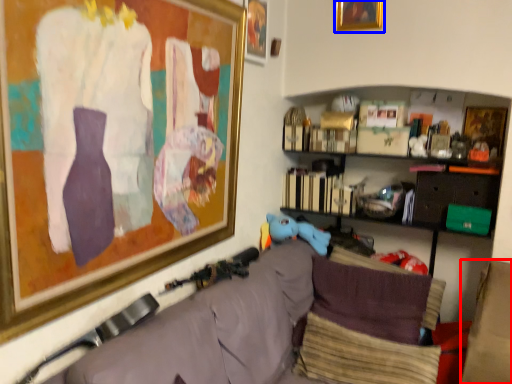
Question: Which object appears closest to the camera in this image, furniture (highlighted by a red box) or picture frame (highlighted by a blue box)?

Choices:
 (A) furniture
 (B) picture frame

Answer: (A)